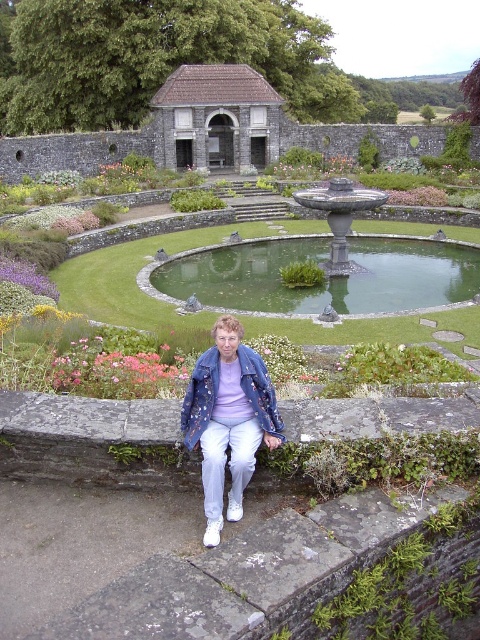
Question: Which object appears closest to the camera in this image?

Choices:
 (A) denim jacket at lower center
 (B) purple matte flower at lower left
 (C) green stone pond at center
 (D) pink matte flowers at lower left

Answer: (A)

Question: Is denim jacket at lower center above purple matte flower at lower left?

Choices:
 (A) yes
 (B) no

Answer: (B)

Question: Among these points, which one is farthest from the camera?

Choices:
 (A) (10, 259)
 (B) (238, 417)
 (C) (95, 392)
 (D) (252, 288)

Answer: (D)

Question: Which object is farther from the camera taking this photo?

Choices:
 (A) green stone pond at center
 (B) denim jacket at lower center

Answer: (A)

Question: In this image, where is denim jacket at lower center located relative to purple matte flower at lower left?

Choices:
 (A) right
 (B) left

Answer: (A)

Question: In this image, where is green stone pond at center located relative to pink matte flowers at lower left?

Choices:
 (A) above
 (B) below

Answer: (A)